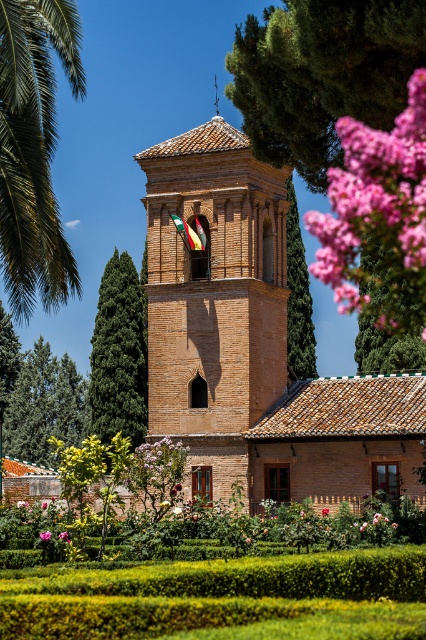
You are a landscape architect planning to install a new pathway between the green textured pine tree at center and the pink matte flower at center. Considering their heights, which object might cast a shadow over the pathway during midday when the sun is directly overhead?

The green textured pine tree at center has a greater height compared to the pink matte flower at center, so it is more likely to cast a shadow over the pathway during midday when the sun is directly overhead.

You are standing in the garden looking at the bell tower. There is a point marked at coordinates (253, 342). What does this point correspond to?

The point at coordinates (253, 342) corresponds to the brown brick church at center.